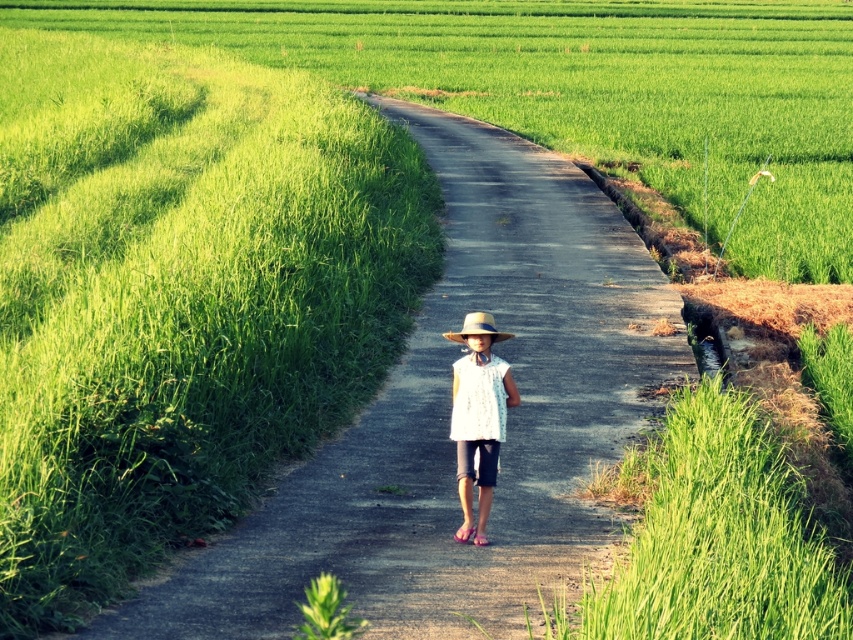
Is white lace dress at center smaller than natural straw hat at center?

No.

Consider the image. Does white lace dress at center lie in front of natural straw hat at center?

No, it is not.

Where is `white lace dress at center`? The image size is (853, 640). white lace dress at center is located at coordinates (479, 417).

The height and width of the screenshot is (640, 853). Identify the location of white lace dress at center. (479, 417).

Does dirt road at center have a larger size compared to natural straw hat at center?

Indeed, dirt road at center has a larger size compared to natural straw hat at center.

Who is taller, dirt road at center or natural straw hat at center?

dirt road at center

What do you see at coordinates (448, 419) in the screenshot?
I see `dirt road at center` at bounding box center [448, 419].

The width and height of the screenshot is (853, 640). Identify the location of dirt road at center. (448, 419).

Which is more to the right, dirt road at center or white lace dress at center?

From the viewer's perspective, dirt road at center appears more on the right side.

Does dirt road at center appear on the right side of white lace dress at center?

Correct, you'll find dirt road at center to the right of white lace dress at center.

Is point (322, 476) less distant than point (488, 467)?

No, (322, 476) is further to viewer.

Locate an element on the screen. dirt road at center is located at coordinates click(448, 419).